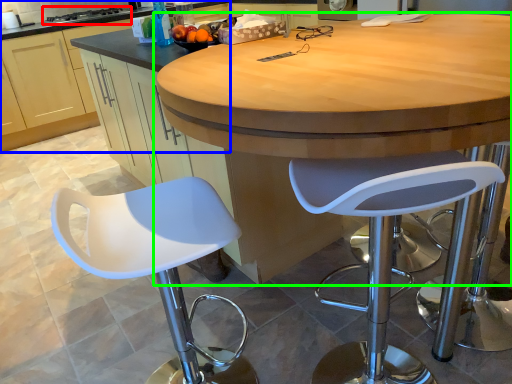
Question: Which is nearer to the stove (highlighted by a red box)? cabinetry (highlighted by a blue box) or table (highlighted by a green box).

Choices:
 (A) cabinetry
 (B) table

Answer: (A)